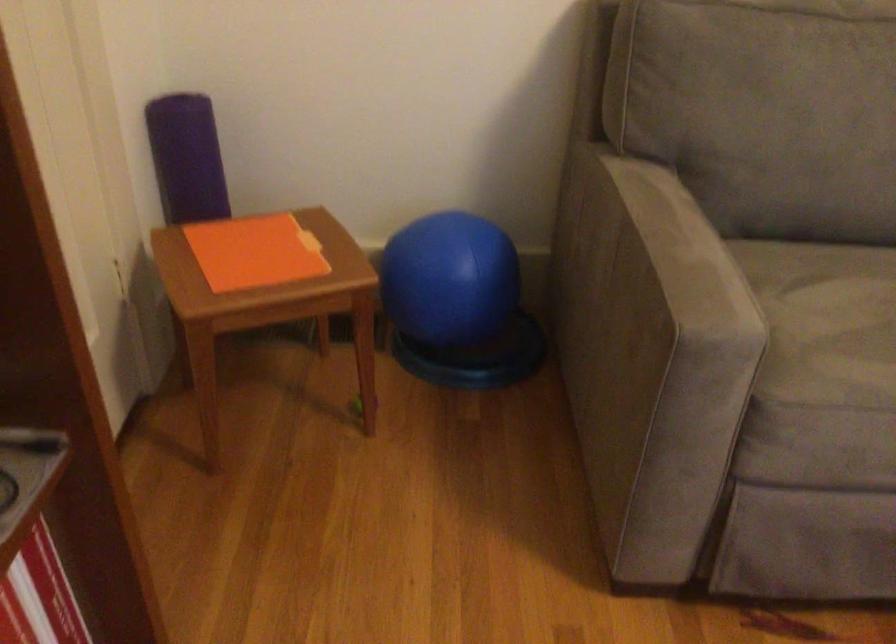
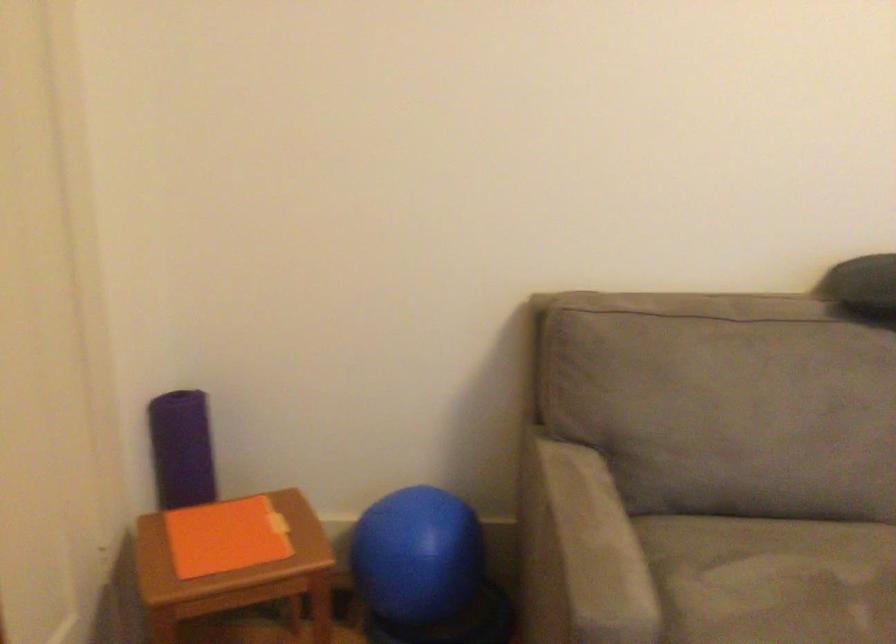
Where in the second image is the point corresponding to point (192, 160) from the first image?

(182, 449)